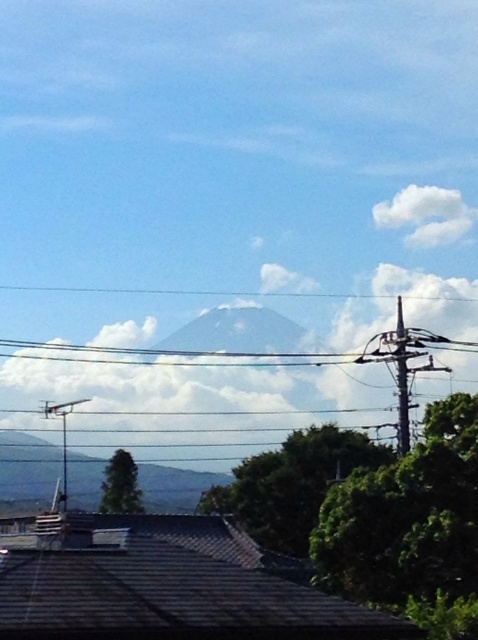
Looking at this image, you are a photographer planning to capture the scenic view of the mountain. You notice a green leafy tree at center and a metallic gray pole at right in your shot. Which object is positioned lower in the frame?

The green leafy tree at center is located below the metallic gray pole at right, so it is positioned lower in the frame.